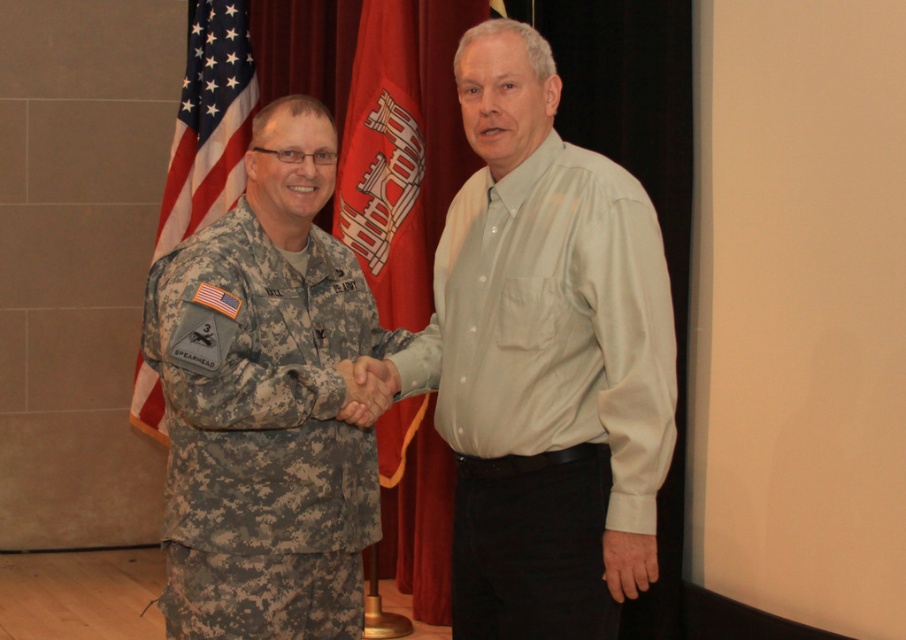
Question: Can you confirm if red fabric flag at center is positioned above american flag at left?

Choices:
 (A) yes
 (B) no

Answer: (B)

Question: Which of these objects is positioned farthest from the light gray cotton shirt at right?

Choices:
 (A) american flag at left
 (B) camouflage fabric uniform at left

Answer: (A)

Question: Among these objects, which one is farthest from the camera?

Choices:
 (A) american flag at left
 (B) light gray cotton shirt at right
 (C) red fabric flag at center

Answer: (A)

Question: Which object is farther from the camera taking this photo?

Choices:
 (A) camouflage fabric uniform at left
 (B) light gray cotton shirt at right

Answer: (A)

Question: Can you confirm if camouflage fabric uniform at left is positioned above american flag at left?

Choices:
 (A) yes
 (B) no

Answer: (B)

Question: Considering the relative positions of camouflage fabric uniform at left and light gray cotton shirt at right in the image provided, where is camouflage fabric uniform at left located with respect to light gray cotton shirt at right?

Choices:
 (A) below
 (B) above

Answer: (A)